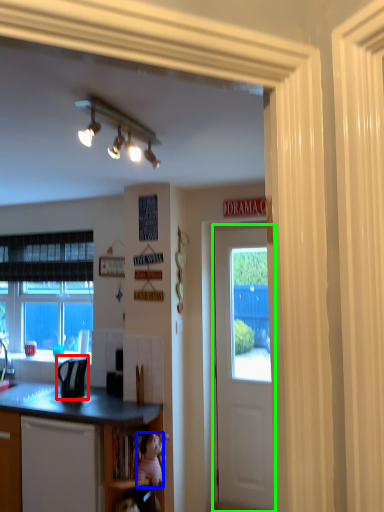
Question: Based on their relative distances, which object is nearer to appliance (highlighted by a red box)? Choose from teddy bear (highlighted by a blue box) and door (highlighted by a green box).

Choices:
 (A) teddy bear
 (B) door

Answer: (A)